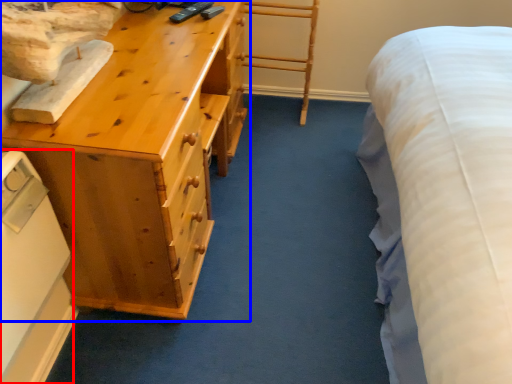
Question: Which of the following is the farthest to the observer, appliance (highlighted by a red box) or chest of drawers (highlighted by a blue box)?

Choices:
 (A) appliance
 (B) chest of drawers

Answer: (B)